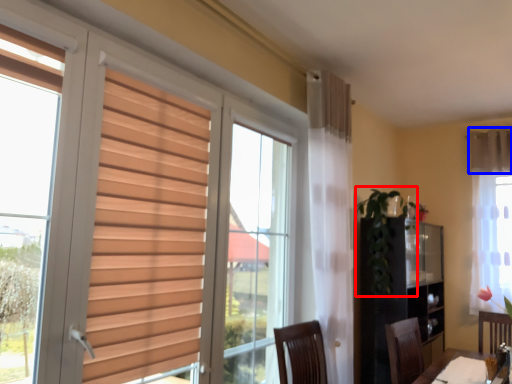
Question: Among these objects, which one is nearest to the camera, plant (highlighted by a red box) or curtain (highlighted by a blue box)?

Choices:
 (A) plant
 (B) curtain

Answer: (A)